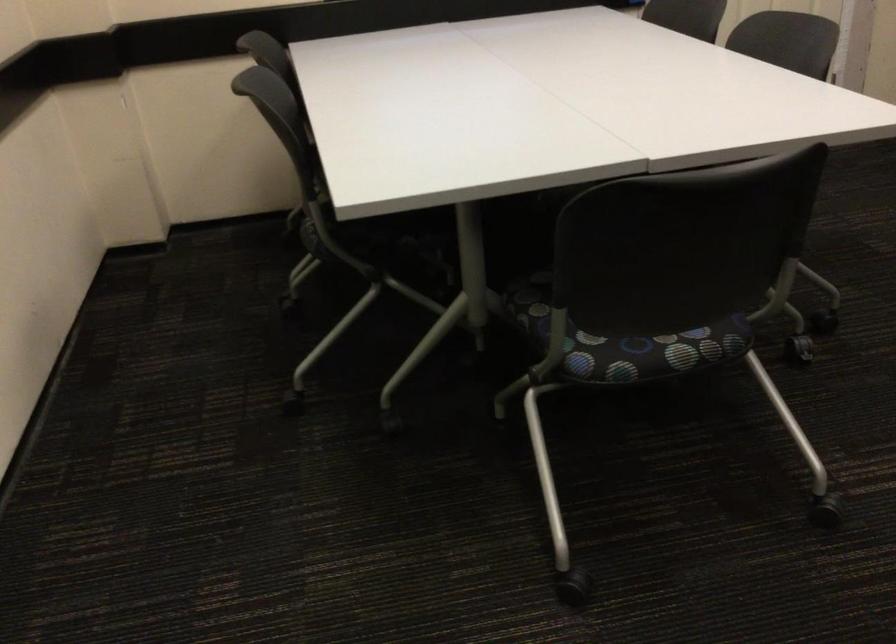
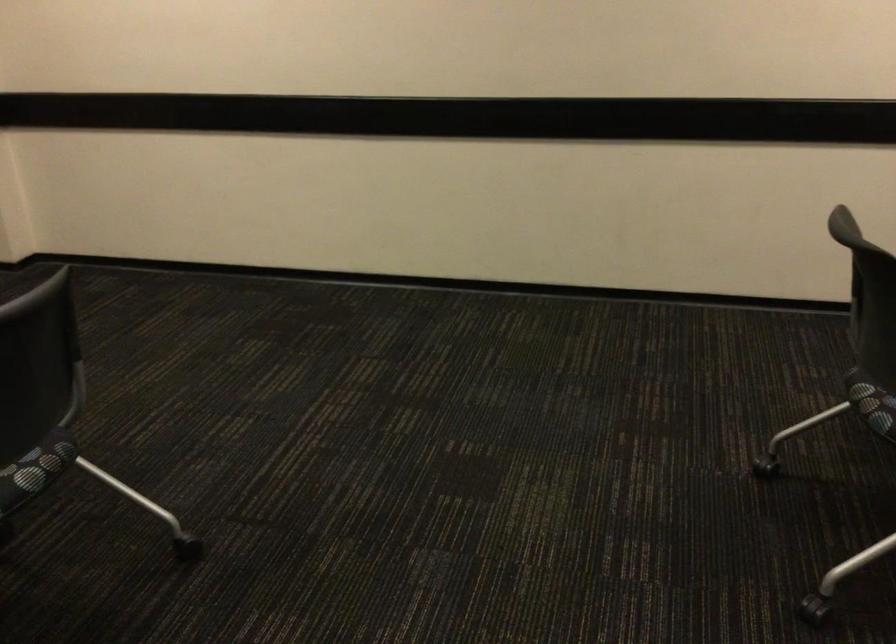
Find the pixel in the second image that matches pixel 698 357 in the first image.

(874, 408)